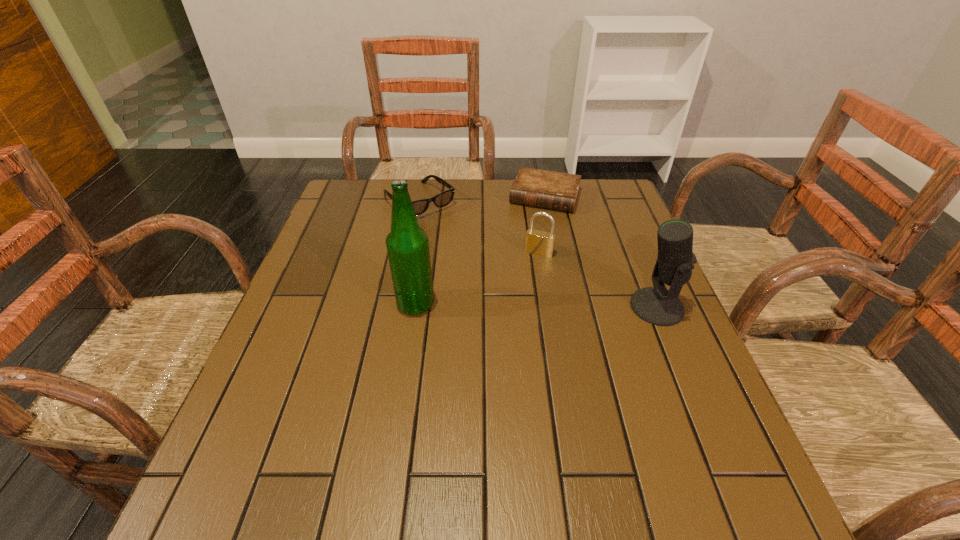
This screenshot has width=960, height=540. Find the location of `vacant space at the near left corner of the desktop`. vacant space at the near left corner of the desktop is located at coordinates (244, 418).

The width and height of the screenshot is (960, 540). I want to click on free region at the far right corner, so click(613, 197).

At what (x,y) coordinates should I click in order to perform the action: click on free space at the near right corner of the desktop. Please return your answer as a coordinate pair (x, y). Image resolution: width=960 pixels, height=540 pixels. Looking at the image, I should click on (638, 429).

Image resolution: width=960 pixels, height=540 pixels. Find the location of `free space between the third farthest object and the beer bottle`. free space between the third farthest object and the beer bottle is located at coordinates (477, 279).

At what (x,y) coordinates should I click in order to perform the action: click on empty space between the shortest object and the tallest object. Please return your answer as a coordinate pair (x, y). This screenshot has width=960, height=540. Looking at the image, I should click on (480, 251).

You are a GUI agent. You are given a task and a screenshot of the screen. Output one action in this format:
    pyautogui.click(x=<x>, y=<y>)
    Task: Click on the vacant region between the fourth shortest object and the third shortest object
    The image size is (960, 540).
    Given the screenshot: What is the action you would take?
    pyautogui.click(x=598, y=280)

Image resolution: width=960 pixels, height=540 pixels. I want to click on vacant point located between the padlock and the second shortest object, so click(479, 227).

Where is `vacant area between the microphone and the padlock`? This screenshot has height=540, width=960. vacant area between the microphone and the padlock is located at coordinates (598, 280).

Locate an element on the screen. The width and height of the screenshot is (960, 540). free space that is in between the padlock and the beer bottle is located at coordinates (477, 279).

This screenshot has height=540, width=960. I want to click on free space that is in between the rightmost object and the tallest object, so click(536, 306).